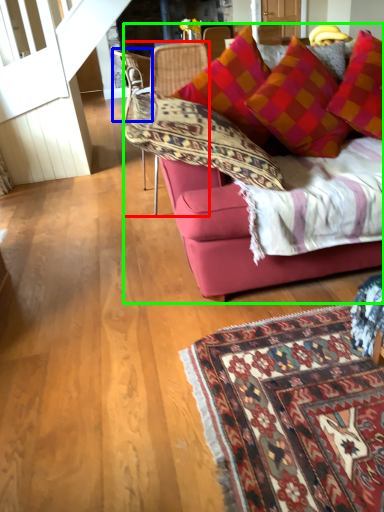
Question: Based on their relative distances, which object is farther from chair (highlighted by a red box)? Choose from chair (highlighted by a blue box) and studio couch (highlighted by a green box).

Choices:
 (A) chair
 (B) studio couch

Answer: (A)